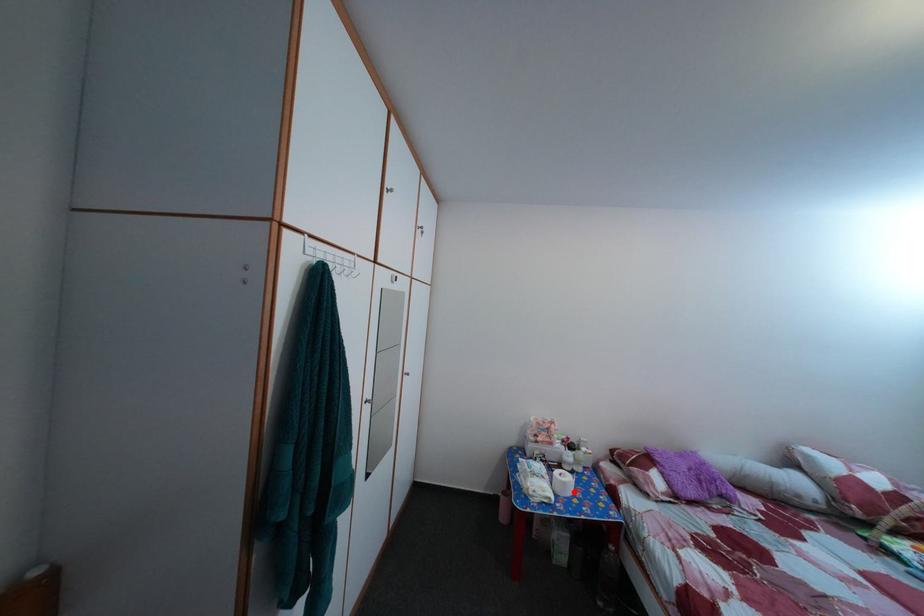
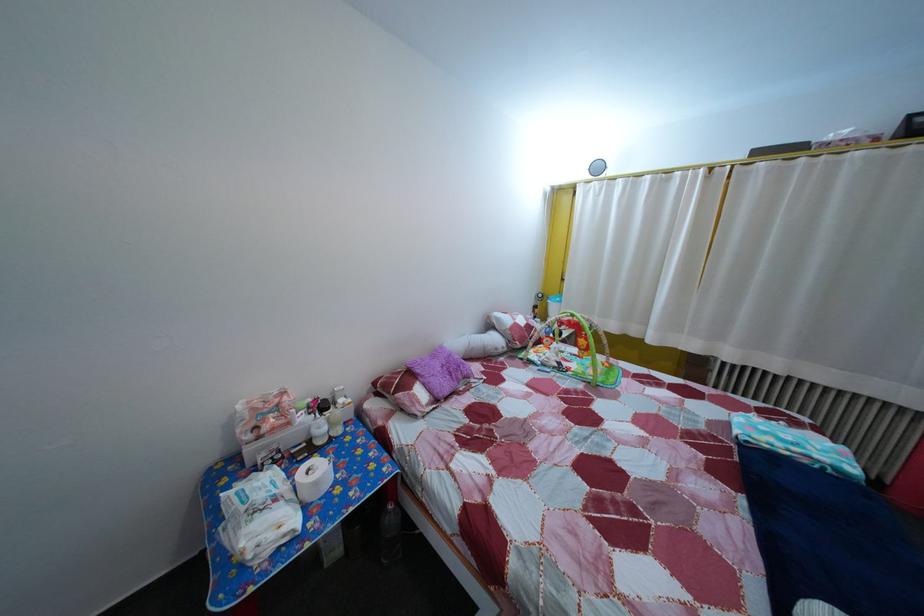
Locate, in the second image, the point that corresponds to the highlighted location in the first image.

(325, 491)